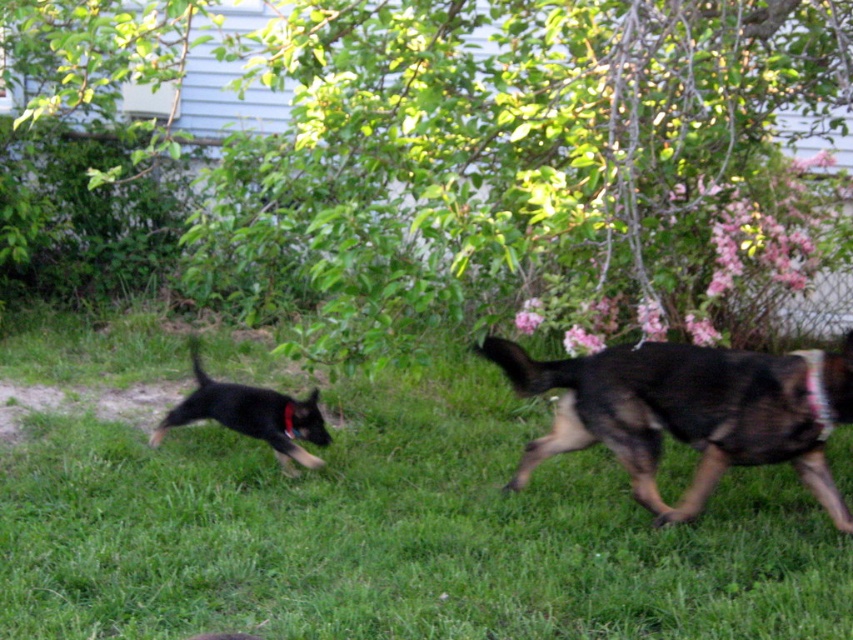
Question: Is black fur dog at right to the right of black glossy dog at left from the viewer's perspective?

Choices:
 (A) yes
 (B) no

Answer: (A)

Question: Which object is the closest to the green grass at center?

Choices:
 (A) red fabric neckband at right
 (B) black glossy dog at left
 (C) black fur dog at right

Answer: (C)

Question: Which of the following is the farthest from the observer?

Choices:
 (A) [x=665, y=634]
 (B) [x=811, y=390]
 (C) [x=155, y=436]
 (D) [x=637, y=465]

Answer: (C)

Question: Which of the following is the closest to the observer?

Choices:
 (A) (592, 531)
 (B) (820, 424)
 (C) (606, 419)

Answer: (B)

Question: Considering the relative positions of green grass at center and black fur dog at right in the image provided, where is green grass at center located with respect to black fur dog at right?

Choices:
 (A) above
 (B) below

Answer: (B)

Question: Does black glossy dog at left have a greater width compared to red fabric neckband at right?

Choices:
 (A) no
 (B) yes

Answer: (B)